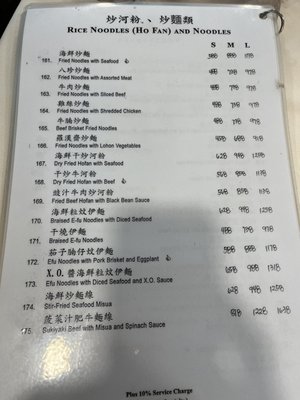
Locate an element on the screen. This screenshot has width=300, height=400. white table is located at coordinates (296, 122).